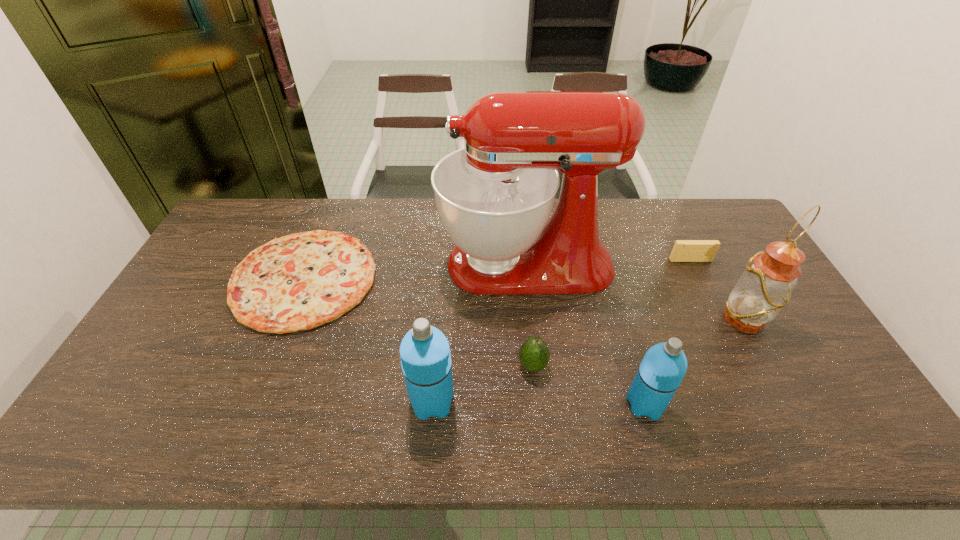
Where is `pizza that is at the far edge`? Image resolution: width=960 pixels, height=540 pixels. pizza that is at the far edge is located at coordinates (297, 282).

At what (x,y) coordinates should I click in order to perform the action: click on mixer that is at the far edge. Please return your answer as a coordinate pair (x, y). The width and height of the screenshot is (960, 540). Looking at the image, I should click on (495, 196).

The width and height of the screenshot is (960, 540). Find the location of `avocado present at the near edge`. avocado present at the near edge is located at coordinates (534, 354).

Identify the location of object that is at the left edge. This screenshot has width=960, height=540. (297, 282).

This screenshot has height=540, width=960. I want to click on videotape positioned at the right edge, so click(684, 250).

Locate an element on the screen. The height and width of the screenshot is (540, 960). oil lamp positioned at the right edge is located at coordinates coord(765,287).

Image resolution: width=960 pixels, height=540 pixels. In order to click on object at the far left corner in this screenshot , I will do `click(297, 282)`.

Find the location of `blank space at the far edge`. blank space at the far edge is located at coordinates (272, 223).

This screenshot has width=960, height=540. What are the coordinates of `vacant space at the near edge of the desktop` in the screenshot? It's located at (300, 382).

Image resolution: width=960 pixels, height=540 pixels. Find the location of `free space at the left edge of the desktop`. free space at the left edge of the desktop is located at coordinates (179, 369).